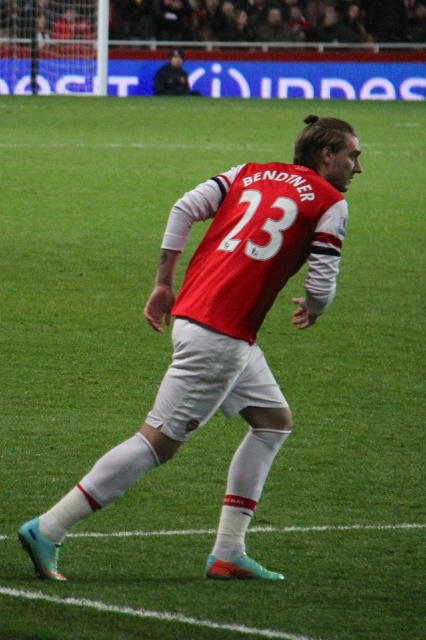
Between point (264, 308) and point (176, 61), which one is positioned in front?

Point (264, 308)

Between point (152, 428) and point (181, 93), which one is positioned behind?

Point (181, 93)

Locate an element on the screen. This screenshot has height=640, width=426. red matte jersey at center is located at coordinates (227, 332).